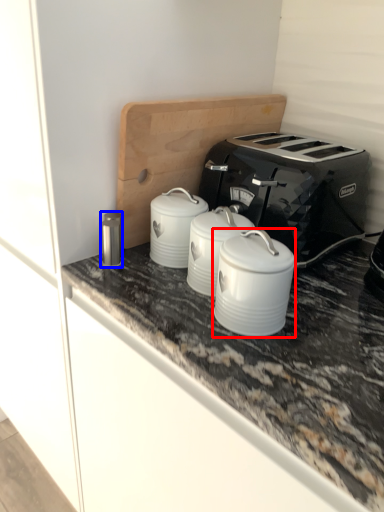
Question: Among these objects, which one is farthest to the camera, appliance (highlighted by a red box) or appliance (highlighted by a blue box)?

Choices:
 (A) appliance
 (B) appliance

Answer: (B)